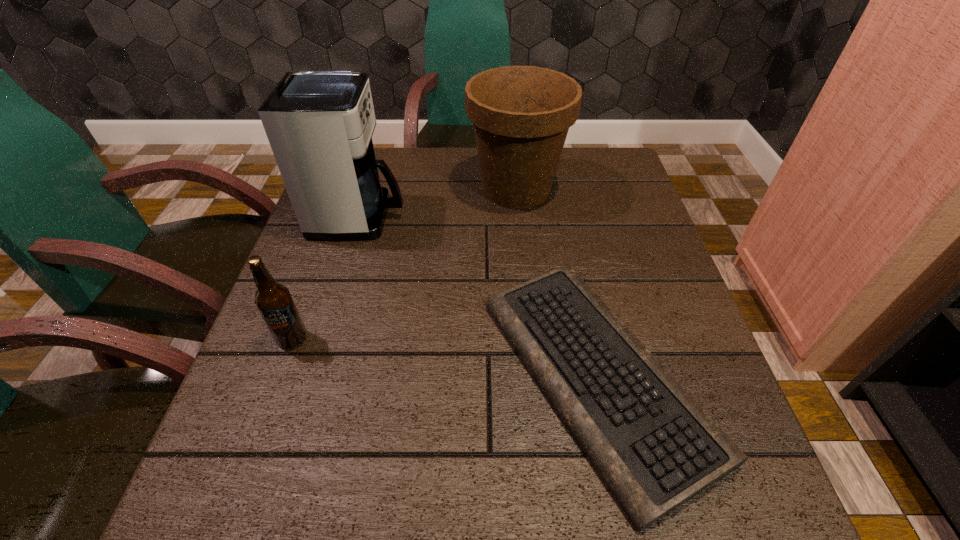
Locate an element on the screen. Image resolution: width=960 pixels, height=540 pixels. object positioned at the near edge is located at coordinates (655, 448).

Identify the location of coffee maker located at the left edge. This screenshot has height=540, width=960. (319, 124).

Locate an element on the screen. The width and height of the screenshot is (960, 540). beer bottle present at the left edge is located at coordinates (273, 300).

At what (x,y) coordinates should I click in order to perform the action: click on object at the right edge. Please return your answer as a coordinate pair (x, y). This screenshot has width=960, height=540. Looking at the image, I should click on pyautogui.click(x=655, y=448).

Identify the location of object located at the far left corner. The height and width of the screenshot is (540, 960). (319, 124).

Locate an element on the screen. The height and width of the screenshot is (540, 960). object at the near right corner is located at coordinates (655, 448).

Find the location of a particular element. This screenshot has height=540, width=960. vacant area at the far edge is located at coordinates point(423,180).

In the image, there is a desktop. At what (x,y) coordinates should I click in order to perform the action: click on free space at the near edge. Please return your answer as a coordinate pair (x, y). This screenshot has height=540, width=960. Looking at the image, I should click on (421, 526).

Find the location of a particular element. free space at the left edge of the desktop is located at coordinates (261, 420).

Locate an element on the screen. The height and width of the screenshot is (540, 960). vacant area at the right edge is located at coordinates (642, 289).